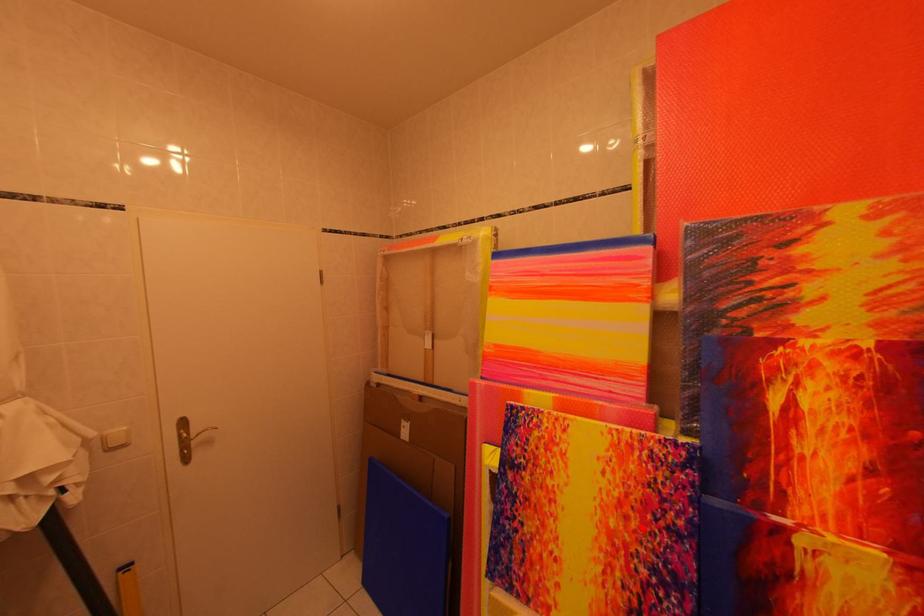
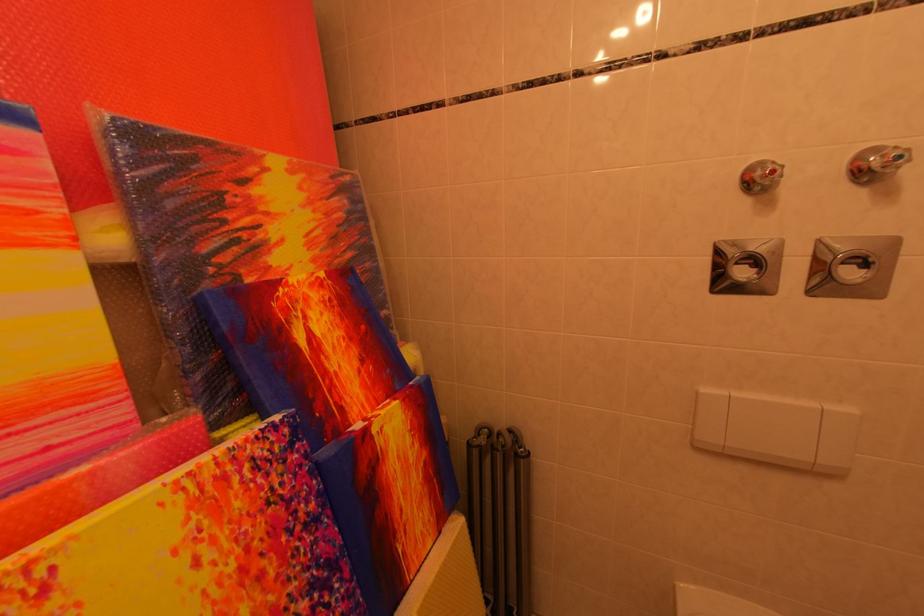
Find the pixel in the second image that matches the highlighted location in the first image.

(281, 575)